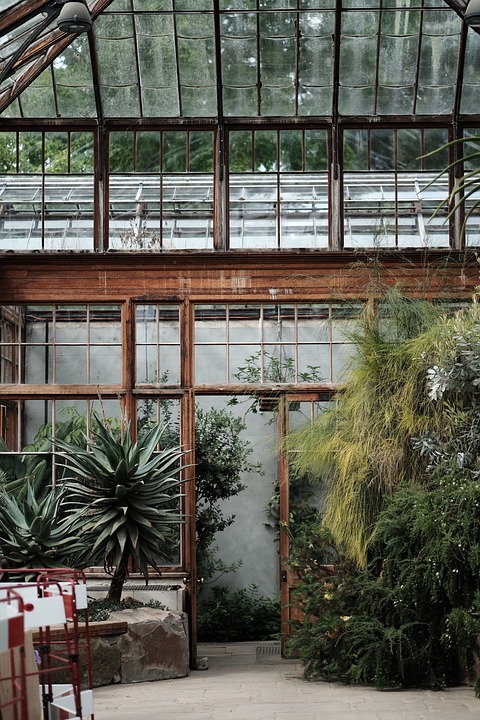
This screenshot has height=720, width=480. What are the coordinates of `wood frame between windows` in the screenshot? It's located at (117, 281), (402, 276).